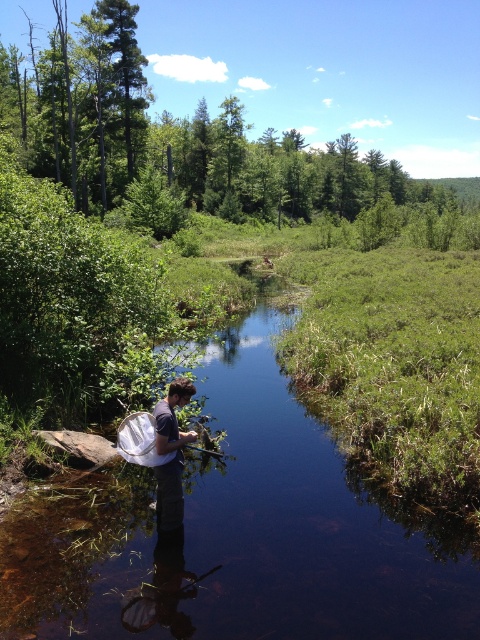
Question: Observing the image, what is the correct spatial positioning of clear water at center in reference to dark blue fabric shirt at center?

Choices:
 (A) below
 (B) above

Answer: (A)

Question: Can you confirm if clear water at center is positioned to the right of dark blue fabric shirt at center?

Choices:
 (A) yes
 (B) no

Answer: (A)

Question: Which point is farther to the camera?

Choices:
 (A) dark blue fabric shirt at center
 (B) clear water at center

Answer: (A)

Question: Can you confirm if clear water at center is positioned above dark blue fabric shirt at center?

Choices:
 (A) no
 (B) yes

Answer: (A)